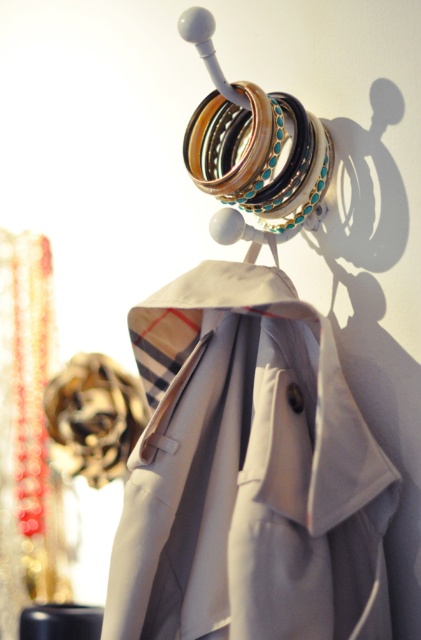
You are a photographer standing 30 inches away from the camera. You want to take a photo of the light beige fabric coat at center. Is the coat within the camera focus range if the camera has a minimum focus distance of 24 inches?

The light beige fabric coat at center and camera are 26.81 inches apart from each other. Since the minimum focus distance is 24 inches, the coat is within the focus range because 26.81 inches is greater than 24 inches.

You are standing in a room and see the light beige fabric coat at center and the shiny gold bangles at center. Which object is positioned more to the left?

The light beige fabric coat at center is positioned to the left of the shiny gold bangles at center, so it is more to the left.

You are a fashion designer observing the light beige fabric coat at center and the shiny gold bangles at center. Which object is taller?

The light beige fabric coat at center is taller than the shiny gold bangles at center.